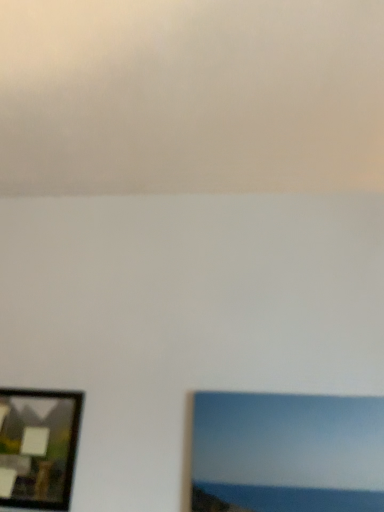
Question: Considering the positions of matte blue picture frame at lower right, the 1th picture frame viewed from the right, and matte black picture frame at lower left, positioned as the 2th picture frame in right-to-left order, in the image, is matte blue picture frame at lower right, the 1th picture frame viewed from the right, wider or thinner than matte black picture frame at lower left, positioned as the 2th picture frame in right-to-left order,?

Choices:
 (A) wide
 (B) thin

Answer: (A)

Question: In terms of height, does matte blue picture frame at lower right, the 1th picture frame viewed from the right, look taller or shorter compared to matte black picture frame at lower left, positioned as the 2th picture frame in right-to-left order?

Choices:
 (A) short
 (B) tall

Answer: (A)

Question: Considering the positions of point (271, 452) and point (31, 501), is point (271, 452) closer or farther from the camera than point (31, 501)?

Choices:
 (A) closer
 (B) farther

Answer: (A)

Question: Considering the positions of matte black picture frame at lower left, positioned as the 2th picture frame in right-to-left order, and matte blue picture frame at lower right, the 1th picture frame viewed from the right, in the image, is matte black picture frame at lower left, positioned as the 2th picture frame in right-to-left order, wider or thinner than matte blue picture frame at lower right, the 1th picture frame viewed from the right,?

Choices:
 (A) wide
 (B) thin

Answer: (B)

Question: Considering the relative positions of matte black picture frame at lower left, positioned as the 2th picture frame in right-to-left order, and matte blue picture frame at lower right, the 1th picture frame viewed from the right, in the image provided, is matte black picture frame at lower left, positioned as the 2th picture frame in right-to-left order, to the left or to the right of matte blue picture frame at lower right, the 1th picture frame viewed from the right,?

Choices:
 (A) right
 (B) left

Answer: (B)

Question: Choose the correct answer: Is matte black picture frame at lower left, positioned as the 2th picture frame in right-to-left order, inside matte blue picture frame at lower right, the 1th picture frame viewed from the right, or outside it?

Choices:
 (A) inside
 (B) outside

Answer: (B)

Question: Is point (19, 502) positioned closer to the camera than point (360, 451)?

Choices:
 (A) closer
 (B) farther

Answer: (B)